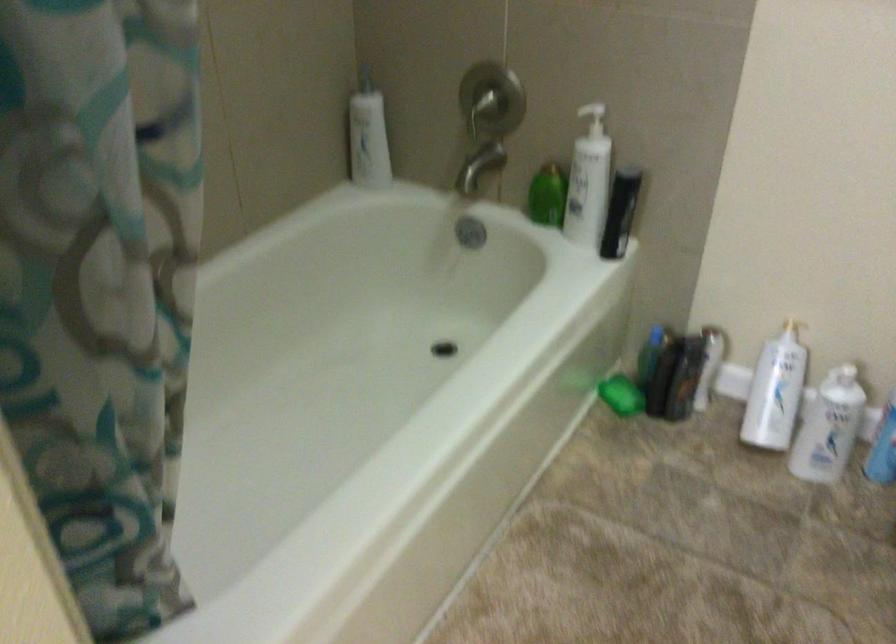
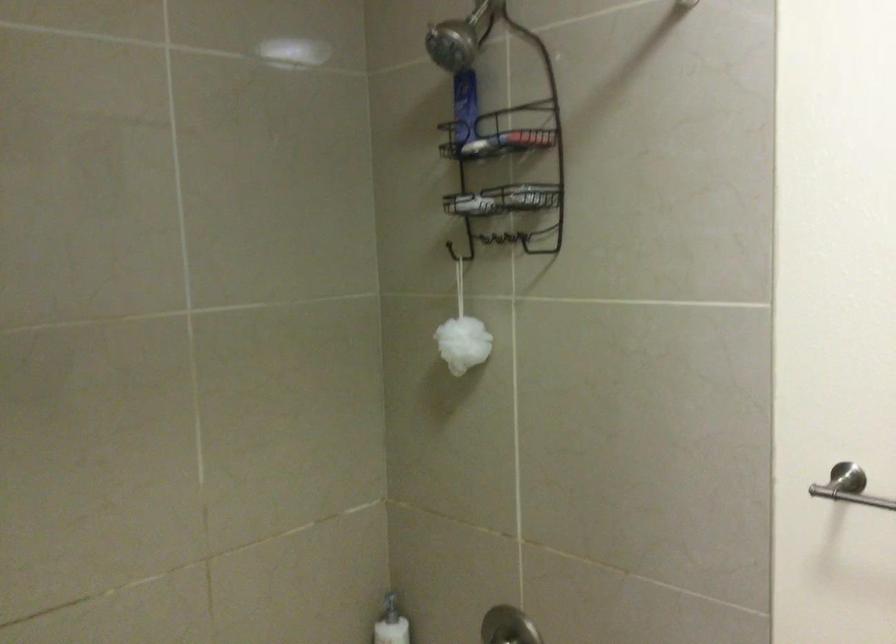
In the second image, find the point that corresponds to point 485,87 in the first image.

(506, 627)